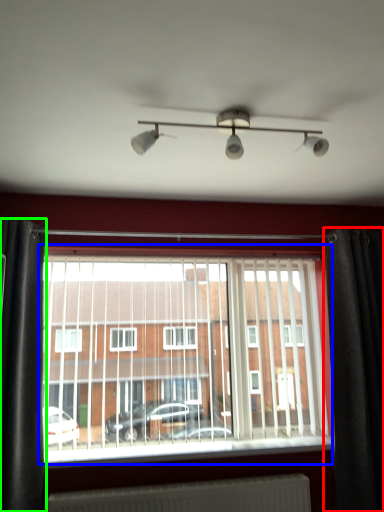
Question: Considering the real-world distances, which object is closest to curtain (highlighted by a red box)? window (highlighted by a blue box) or curtain (highlighted by a green box).

Choices:
 (A) window
 (B) curtain

Answer: (A)